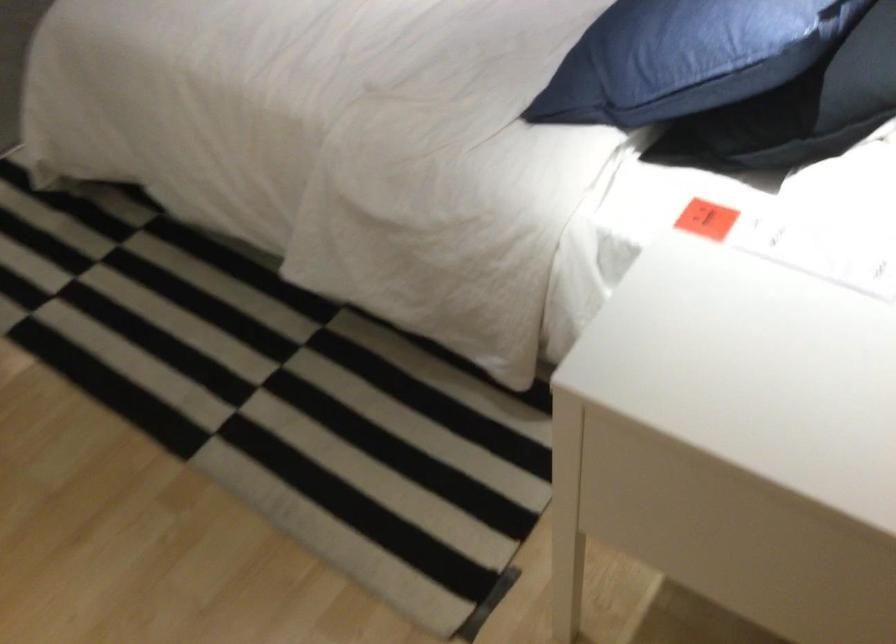
This screenshot has height=644, width=896. Identify the location of black pillow. (808, 108).